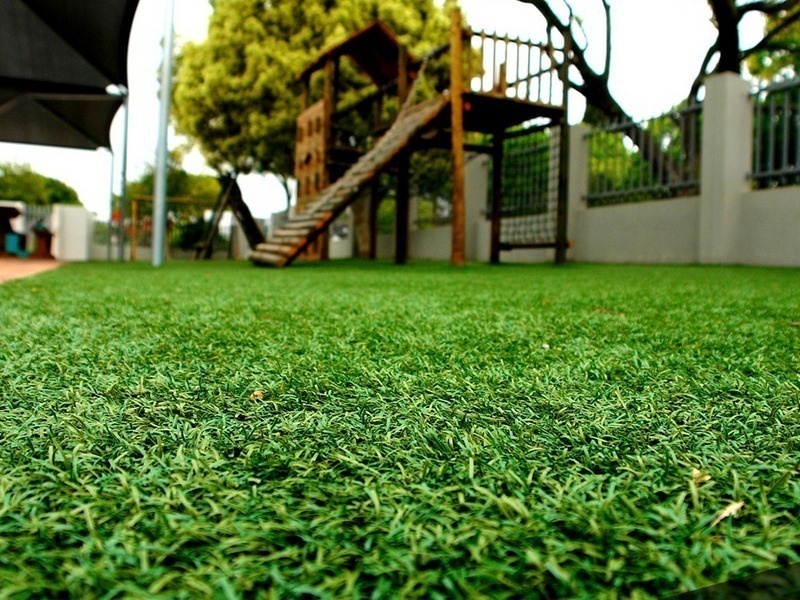
At what (x,y) coordinates should I click in order to perform the action: click on stairs. Please return your answer as a coordinate pair (x, y). Looking at the image, I should click on (290, 236).